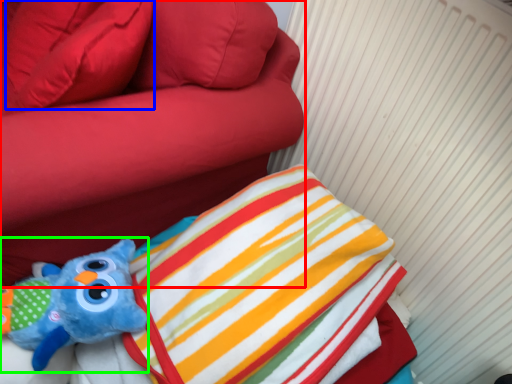
Question: Considering the real-world distances, which object is closest to furniture (highlighted by a red box)? pillow (highlighted by a blue box) or toy (highlighted by a green box).

Choices:
 (A) pillow
 (B) toy

Answer: (A)